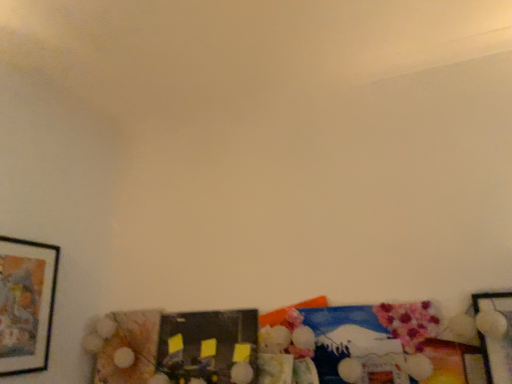
Question: Relative to metallic silver picture frame at lower right, the 3th picture frame positioned from the left, is matte black picture frame at left, the 1th picture frame from the left, in front or behind?

Choices:
 (A) front
 (B) behind

Answer: (B)

Question: In terms of height, does matte black picture frame at left, acting as the 3th picture frame starting from the right, look taller or shorter compared to metallic silver picture frame at lower right, the 3th picture frame positioned from the left?

Choices:
 (A) tall
 (B) short

Answer: (A)

Question: Which is nearer to the matte black picture frame at left, the 1th picture frame from the left?

Choices:
 (A) matte black picture frame at center, placed as the second picture frame when sorted from left to right
 (B) metallic silver picture frame at lower right, marked as the first picture frame in a right-to-left arrangement

Answer: (A)

Question: Which object is the farthest from the metallic silver picture frame at lower right, marked as the first picture frame in a right-to-left arrangement?

Choices:
 (A) matte black picture frame at center, placed as the second picture frame when sorted from left to right
 (B) matte black picture frame at left, acting as the 3th picture frame starting from the right

Answer: (B)